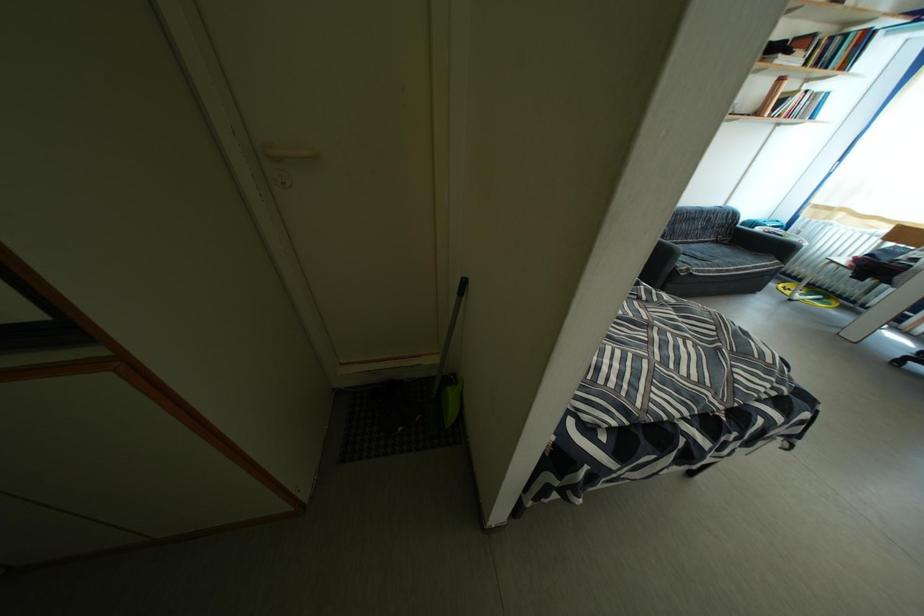
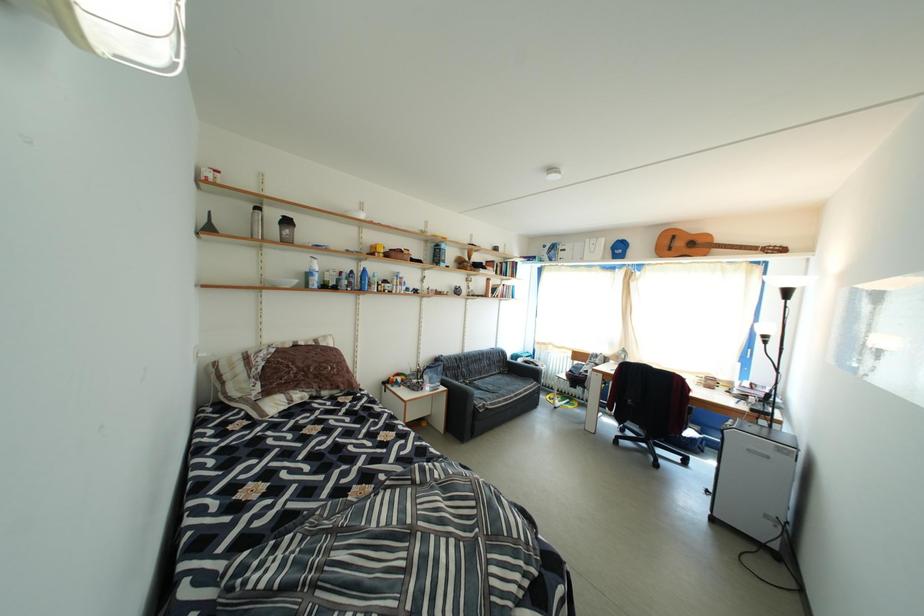
First-person continuous shooting, in which direction is the camera rotating?

The camera rotated toward right-up.